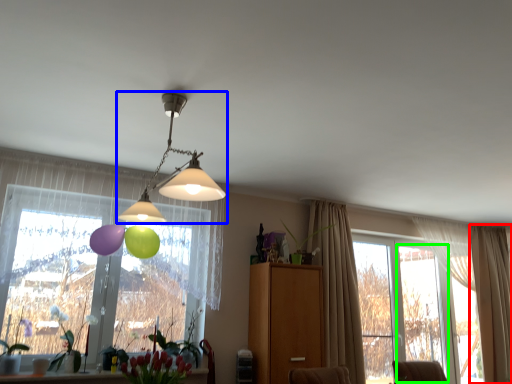
Question: Estimate the real-world distances between objects in this image. Which object is farther from curtain (highlighted by a red box), lamp (highlighted by a blue box) or window frame (highlighted by a green box)?

Choices:
 (A) lamp
 (B) window frame

Answer: (A)